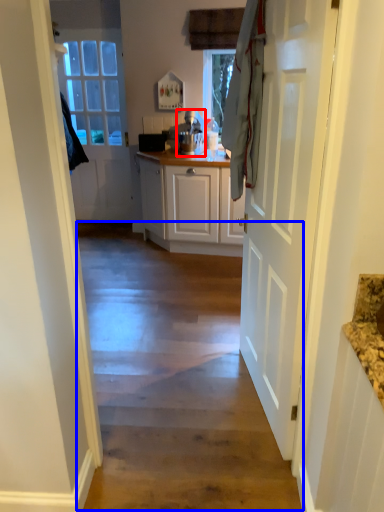
Question: Which point is further to the camera, appliance (highlighted by a red box) or path (highlighted by a blue box)?

Choices:
 (A) appliance
 (B) path

Answer: (A)